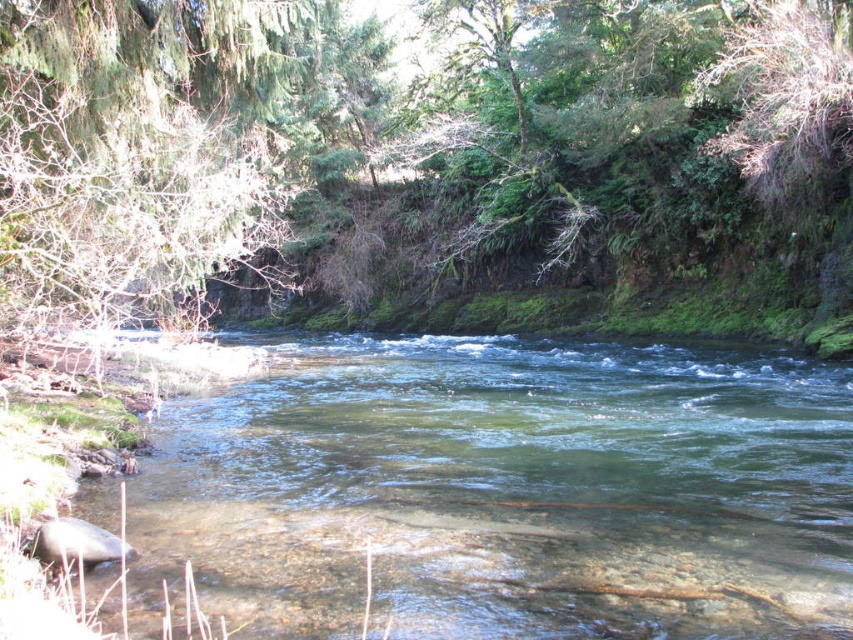
Question: Among these points, which one is nearest to the camera?

Choices:
 (A) (550, 342)
 (B) (318, 202)

Answer: (A)

Question: Does green mossy tree at center have a greater width compared to clear water at center?

Choices:
 (A) yes
 (B) no

Answer: (A)

Question: Which point is farther to the camera?

Choices:
 (A) clear water at center
 (B) green mossy tree at center

Answer: (B)

Question: Can you confirm if green mossy tree at center is wider than clear water at center?

Choices:
 (A) no
 (B) yes

Answer: (B)

Question: Can you confirm if green mossy tree at center is wider than clear water at center?

Choices:
 (A) no
 (B) yes

Answer: (B)